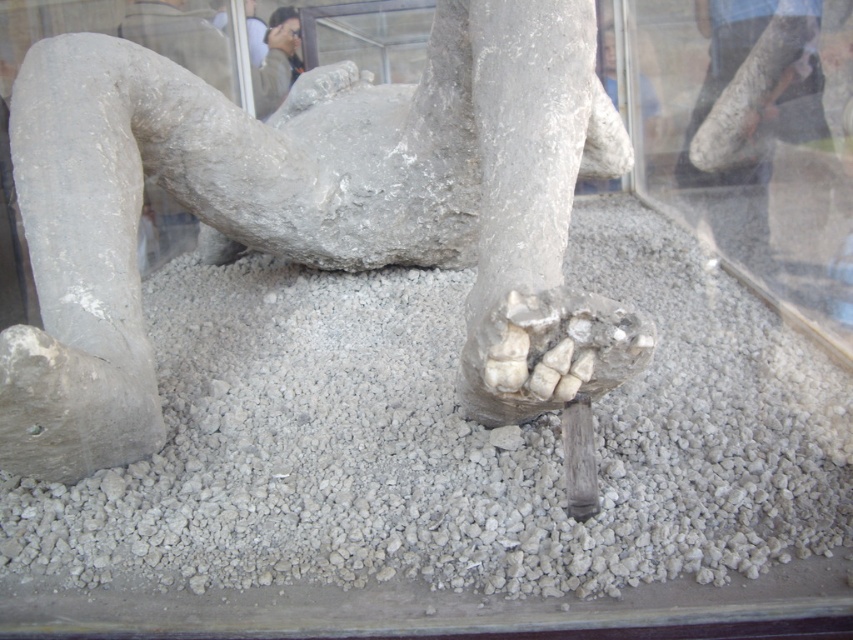
Consider the image. You are a museum visitor observing the display case. You notice two items at the center of the case. Which one is taller between the gray gravel at center and the gray stone statue at center?

The gray stone statue at center is taller than the gray gravel at center.